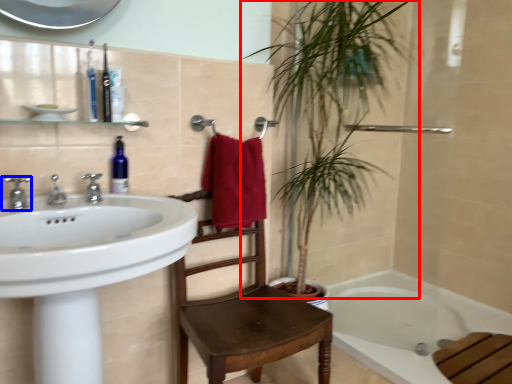
Question: Among these objects, which one is nearest to the camera, vegetation (highlighted by a red box) or tap (highlighted by a blue box)?

Choices:
 (A) vegetation
 (B) tap

Answer: (B)